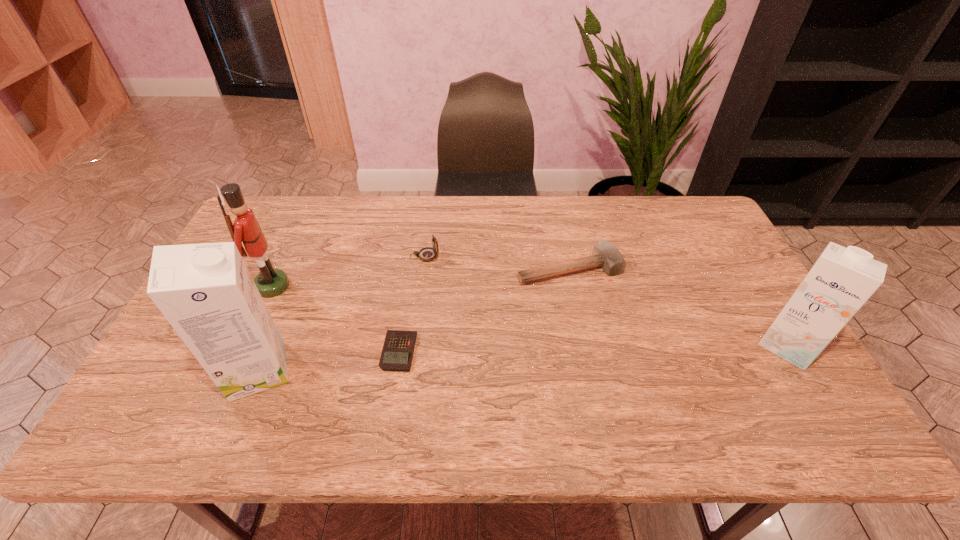
In the image, there is a desktop. In order to click on vacant space at the far edge in this screenshot , I will do `click(599, 209)`.

Image resolution: width=960 pixels, height=540 pixels. In order to click on free spot at the near edge of the desktop in this screenshot , I will do `click(379, 393)`.

In the image, there is a desktop. In order to click on vacant space at the right edge in this screenshot , I will do `click(677, 248)`.

This screenshot has width=960, height=540. In order to click on vacant space at the far left corner of the desktop in this screenshot , I will do `click(272, 235)`.

The image size is (960, 540). What are the coordinates of `free space at the near left corner of the desktop` in the screenshot? It's located at (159, 383).

Identify the location of vacant region at the far right corner of the desktop. (676, 219).

At what (x,y) coordinates should I click in order to perform the action: click on vacant area that lies between the fifth object from left to right and the shortest object. Please return your answer as a coordinate pair (x, y). Looking at the image, I should click on (484, 310).

The width and height of the screenshot is (960, 540). Identify the location of free space between the right carton and the fifth tallest object. (679, 307).

Locate an element on the screen. The width and height of the screenshot is (960, 540). empty location between the nutcracker and the mallet is located at coordinates (420, 278).

Locate an element on the screen. The height and width of the screenshot is (540, 960). blank region between the nutcracker and the fifth tallest object is located at coordinates (420, 278).